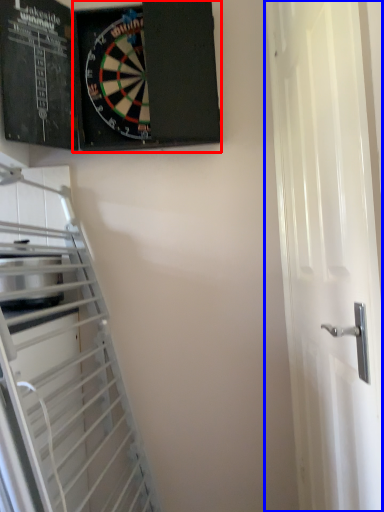
Question: Which object appears farthest to the camera in this image, bulletin board (highlighted by a red box) or door (highlighted by a blue box)?

Choices:
 (A) bulletin board
 (B) door

Answer: (A)